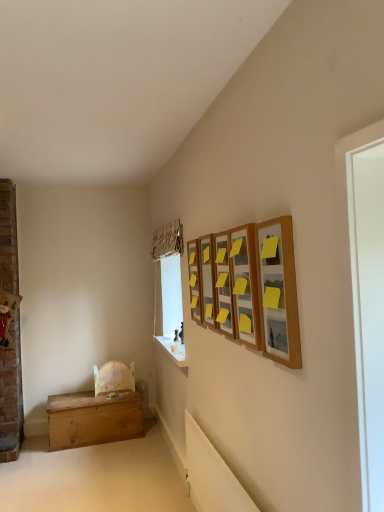
Question: Looking at their shapes, would you say wooden picture frame at upper right, the 2th picture frame viewed from the front, is wider or thinner than wooden chest at lower left?

Choices:
 (A) thin
 (B) wide

Answer: (A)

Question: From the image's perspective, is wooden picture frame at upper right, the 2th picture frame viewed from the front, located above or below wooden chest at lower left?

Choices:
 (A) above
 (B) below

Answer: (A)

Question: Estimate the real-world distances between objects in this image. Which object is farther from the wooden chest at lower left?

Choices:
 (A) wooden picture frame at upper right, which ranks as the 4th picture frame in back-to-front order
 (B) wooden picture frame at upper center, the fifth picture frame positioned from the front
 (C) white smooth window sill at lower center
 (D) wooden picture frame at upper right, which is the 4th picture frame from front to back
 (E) wooden picture frame at upper right, the 5th picture frame positioned from the back

Answer: (E)

Question: Which is farther from the wooden picture frame at upper center, acting as the 3th picture frame starting from the back?

Choices:
 (A) wooden picture frame at upper right, the first picture frame from the front
 (B) white smooth window sill at lower center
 (C) wooden picture frame at upper center, the fifth picture frame positioned from the front
 (D) wooden picture frame at upper right, which ranks as the 4th picture frame in back-to-front order
 (E) wooden chest at lower left

Answer: (E)